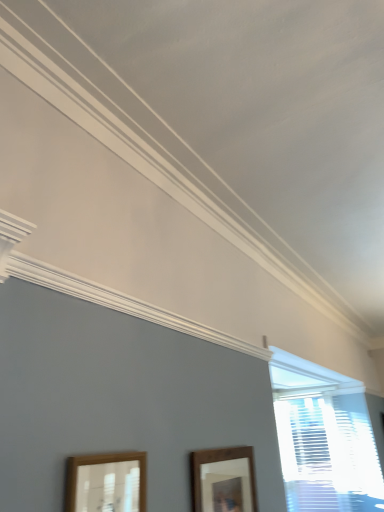
Question: Is white textured blinds at right far from brown wooden picture frame at lower center, which is the 2th picture frame in front-to-back order?

Choices:
 (A) yes
 (B) no

Answer: (A)

Question: From a real-world perspective, is white textured blinds at right on top of brown wooden picture frame at lower center, the 1th picture frame viewed from the right?

Choices:
 (A) yes
 (B) no

Answer: (A)

Question: From the image's perspective, would you say white textured blinds at right is shown under brown wooden picture frame at lower center, the 2th picture frame when ordered from left to right?

Choices:
 (A) no
 (B) yes

Answer: (B)

Question: Is white textured blinds at right in front of brown wooden picture frame at lower center, which is the 2th picture frame in front-to-back order?

Choices:
 (A) no
 (B) yes

Answer: (A)

Question: Considering the relative sizes of white textured blinds at right and brown wooden picture frame at lower center, which is the 2th picture frame in front-to-back order, in the image provided, is white textured blinds at right shorter than brown wooden picture frame at lower center, which is the 2th picture frame in front-to-back order,?

Choices:
 (A) no
 (B) yes

Answer: (A)

Question: From the image's perspective, relative to brown wooden picture frame at lower center, which ranks as the first picture frame in back-to-front order, is wooden picture frame at lower left, the 2th picture frame in the back-to-front sequence, above or below?

Choices:
 (A) above
 (B) below

Answer: (A)

Question: From a real-world perspective, is wooden picture frame at lower left, the 2th picture frame in the back-to-front sequence, above or below brown wooden picture frame at lower center, the 1th picture frame viewed from the right?

Choices:
 (A) below
 (B) above

Answer: (A)

Question: Is wooden picture frame at lower left, which is the 1th picture frame from left to right, inside the boundaries of brown wooden picture frame at lower center, which ranks as the first picture frame in back-to-front order, or outside?

Choices:
 (A) inside
 (B) outside

Answer: (B)

Question: Is point (129, 497) positioned closer to the camera than point (248, 445)?

Choices:
 (A) farther
 (B) closer

Answer: (B)

Question: Based on their sizes in the image, would you say white textured blinds at right is bigger or smaller than brown wooden picture frame at lower center, the 2th picture frame when ordered from left to right?

Choices:
 (A) big
 (B) small

Answer: (A)

Question: Is white textured blinds at right to the left or to the right of brown wooden picture frame at lower center, the 2th picture frame when ordered from left to right, in the image?

Choices:
 (A) right
 (B) left

Answer: (A)

Question: Relative to brown wooden picture frame at lower center, which ranks as the first picture frame in back-to-front order, is white textured blinds at right in front or behind?

Choices:
 (A) front
 (B) behind

Answer: (B)

Question: In terms of height, does white textured blinds at right look taller or shorter compared to brown wooden picture frame at lower center, the 2th picture frame when ordered from left to right?

Choices:
 (A) short
 (B) tall

Answer: (B)

Question: Based on their positions, is brown wooden picture frame at lower center, the 2th picture frame when ordered from left to right, located to the left or right of white textured blinds at right?

Choices:
 (A) right
 (B) left

Answer: (B)

Question: Looking at the image, does brown wooden picture frame at lower center, which is the 2th picture frame in front-to-back order, seem bigger or smaller compared to white textured blinds at right?

Choices:
 (A) big
 (B) small

Answer: (B)